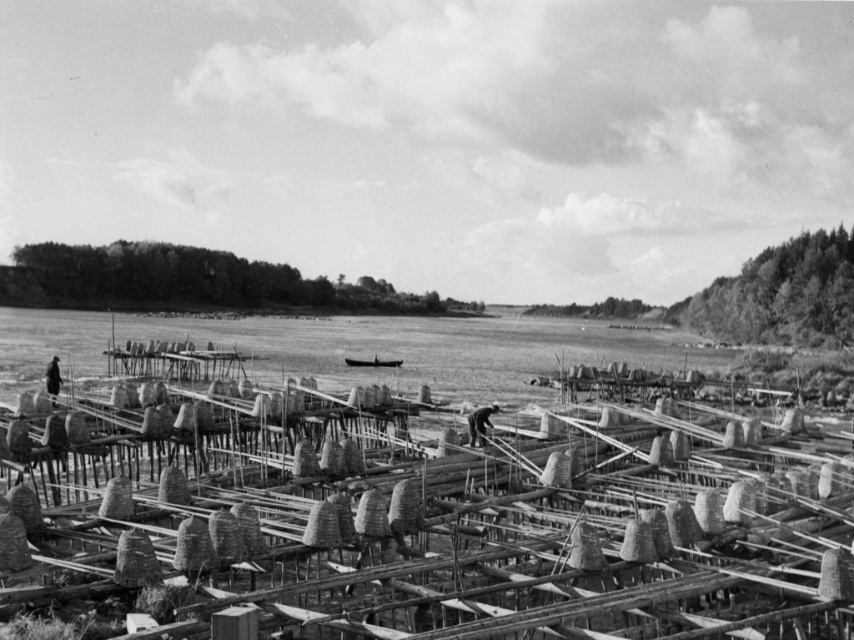
Which is in front, point (469, 429) or point (53, 397)?

Positioned in front is point (469, 429).

The width and height of the screenshot is (854, 640). What do you see at coordinates (478, 422) in the screenshot?
I see `dark gray fabric worker at center` at bounding box center [478, 422].

Locate an element on the screen. This screenshot has height=640, width=854. dark gray fabric worker at center is located at coordinates pyautogui.click(x=478, y=422).

Is dark gray fabric worker at center to the left of smooth wooden boat at center from the viewer's perspective?

No, dark gray fabric worker at center is not to the left of smooth wooden boat at center.

Does point (483, 412) come closer to viewer compared to point (346, 364)?

Yes, it is in front of point (346, 364).

Who is more distant from viewer, [478,422] or [379,358]?

The point [379,358] is more distant.

This screenshot has width=854, height=640. I want to click on dark gray fabric worker at center, so click(478, 422).

What do you see at coordinates (51, 378) in the screenshot? The width and height of the screenshot is (854, 640). I see `dark brown leather jacket at lower left` at bounding box center [51, 378].

Can you confirm if dark brown leather jacket at lower left is positioned above smooth wooden boat at center?

Indeed, dark brown leather jacket at lower left is positioned over smooth wooden boat at center.

At what (x,y) coordinates should I click in order to perform the action: click on dark brown leather jacket at lower left. Please return your answer as a coordinate pair (x, y). Image resolution: width=854 pixels, height=640 pixels. Looking at the image, I should click on (51, 378).